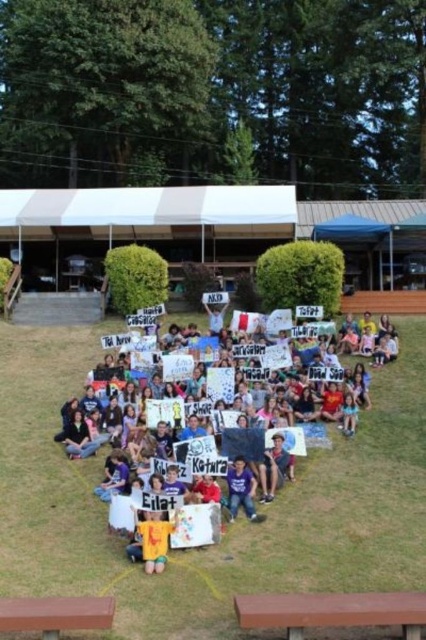
You are organizing a picnic and need to place a blanket on the brown wood picnic table at lower center. Can the purple cotton shirt at center be placed on top of the blanket without hanging off the edge?

The brown wood picnic table at lower center is bigger than the purple cotton shirt at center, so the purple cotton shirt at center can be placed on top of the blanket without hanging off the edge since the table is larger.

You are a photographer trying to capture the multicolored paper signs at center and the brown wood picnic table at lower center in the same frame. Which object should you focus on first if you want to ensure both are in focus, considering their heights?

The multicolored paper signs at center are taller than the brown wood picnic table at lower center. To ensure both are in focus, focus on the multicolored paper signs at center first as they are the taller object.

What is the location of the point with coordinates (212, 417) in the image?

The point with coordinates (212, 417) is on the multicolored paper signs at center.